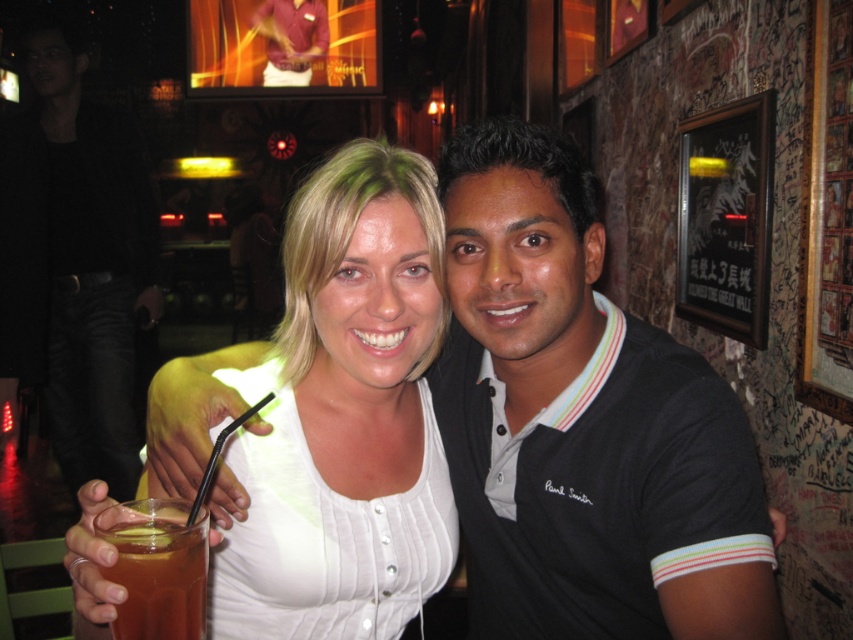
You are a fashion designer observing the clothing items in the scene. Which clothing item, the black cotton polo shirt at center or the white matte tank top at center, has a narrower width?

The black cotton polo shirt at center is thinner than the white matte tank top at center, so the black cotton polo shirt at center has a narrower width.

You are a bartender preparing to clean the area between the black cotton polo shirt at center and the translucent glass drink at lower left. Which object should you clean first if you start from the top and work your way down?

The black cotton polo shirt at center is located above the translucent glass drink at lower left, so you should clean the black cotton polo shirt at center first.